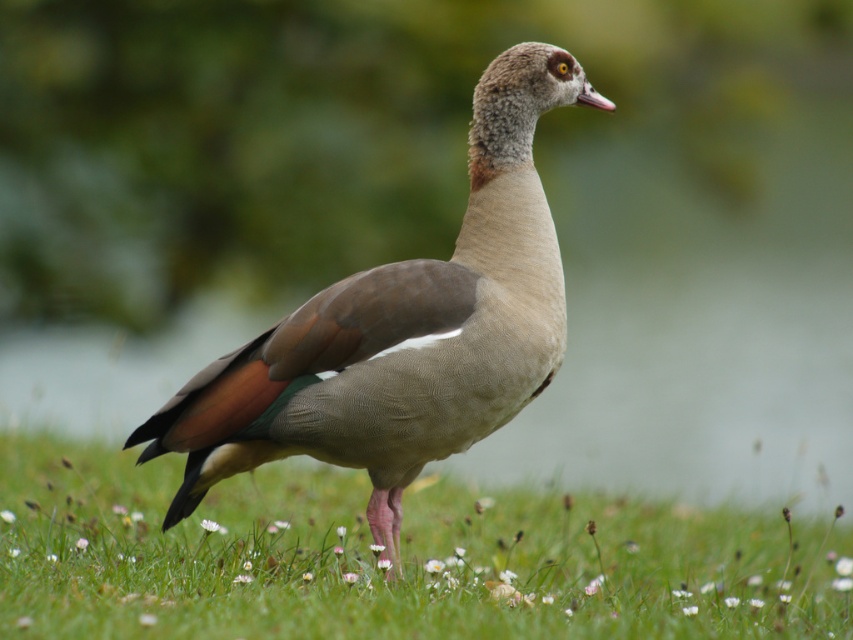
Question: Which point is farther to the camera?

Choices:
 (A) (801, 577)
 (B) (277, 396)

Answer: (A)

Question: Which of the following is the closest to the observer?

Choices:
 (A) (108, 481)
 (B) (183, 490)

Answer: (B)

Question: Does green grass at center appear on the left side of brown feathered duck at center?

Choices:
 (A) no
 (B) yes

Answer: (A)

Question: Among these objects, which one is farthest from the camera?

Choices:
 (A) green grass at center
 (B) brown feathered duck at center

Answer: (A)

Question: Is green grass at center above brown feathered duck at center?

Choices:
 (A) yes
 (B) no

Answer: (B)

Question: Does green grass at center appear under brown feathered duck at center?

Choices:
 (A) yes
 (B) no

Answer: (A)